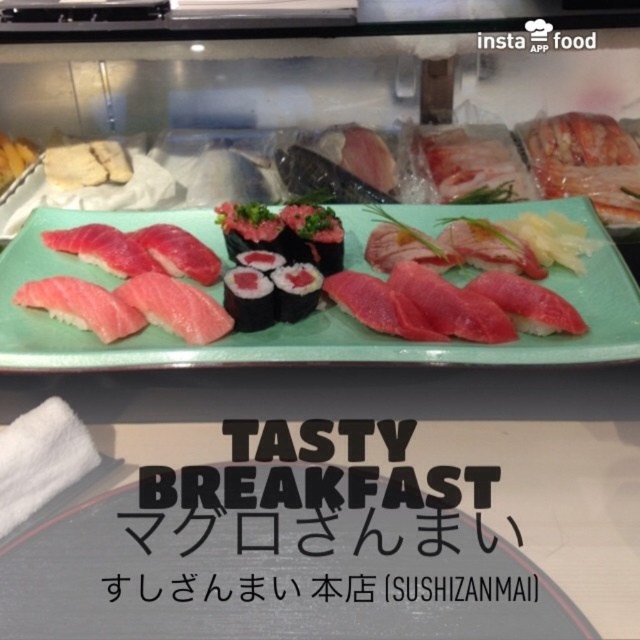
What is the exact coordinate of the black paper sign at center?

The black paper sign at center is located at point (307, 524).

Looking at this image, you are a customer at a sushi restaurant and want to read the black paper sign at center. Where should you look on the plate to find it?

The black paper sign at center is located at point 0.819 on the x axis and 0.481 on the y axis.

You are a customer at a sushi restaurant and want to read the black paper sign at center on the counter. Can you reach it without moving your chair?

The black paper sign at center is 23.49 inches from viewer, so yes, you can reach it without moving your chair since it is within arm reach.